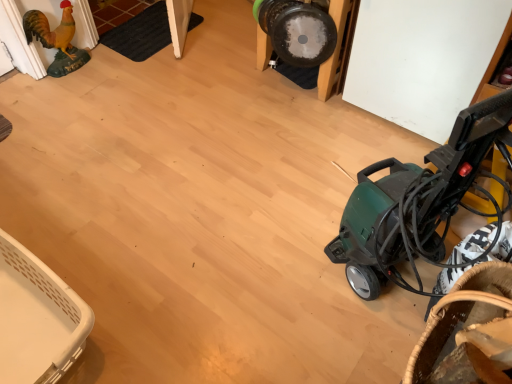
You are a GUI agent. You are given a task and a screenshot of the screen. Output one action in this format:
    pyautogui.click(x=<x>, y=<y>)
    Task: Click on the unoccupied space behind white plastic basket at lower left, the second basket when ordered from right to left
    
    Given the screenshot: What is the action you would take?
    pyautogui.click(x=83, y=217)